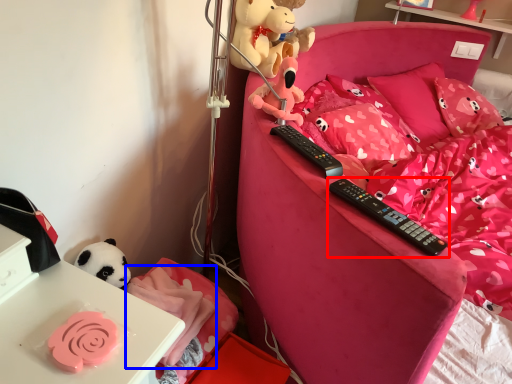
Question: Which point is closer to the camera, remote control (highlighted by a red box) or blanket (highlighted by a blue box)?

Choices:
 (A) remote control
 (B) blanket

Answer: (A)